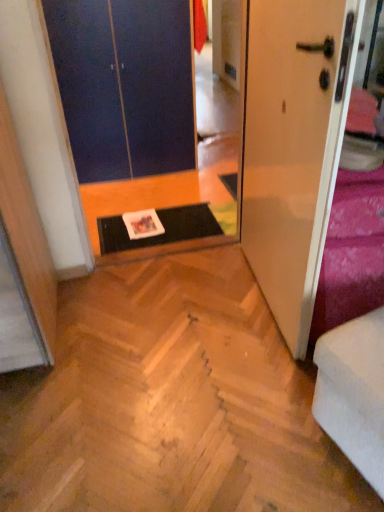
Question: Is natural wood parquet floor at center taller or shorter than blue matte door at upper left, the 2th door positioned from the front?

Choices:
 (A) tall
 (B) short

Answer: (B)

Question: From a real-world perspective, is natural wood parquet floor at center physically located above or below blue matte door at upper left, the first door viewed from the back?

Choices:
 (A) above
 (B) below

Answer: (B)

Question: Which object is the farthest from the white glossy door at right, the 1th door from the right?

Choices:
 (A) natural wood parquet floor at center
 (B) velvet purple bedding at right
 (C) black rubber doormat at center
 (D) white fabric armchair at lower right
 (E) blue matte door at upper left, the 2th door positioned from the front

Answer: (E)

Question: Which object is positioned closest to the natural wood parquet floor at center?

Choices:
 (A) blue matte door at upper left, the 2th door positioned from the front
 (B) black rubber doormat at center
 (C) white fabric armchair at lower right
 (D) velvet purple bedding at right
 (E) white glossy door at right, the first door viewed from the front

Answer: (C)